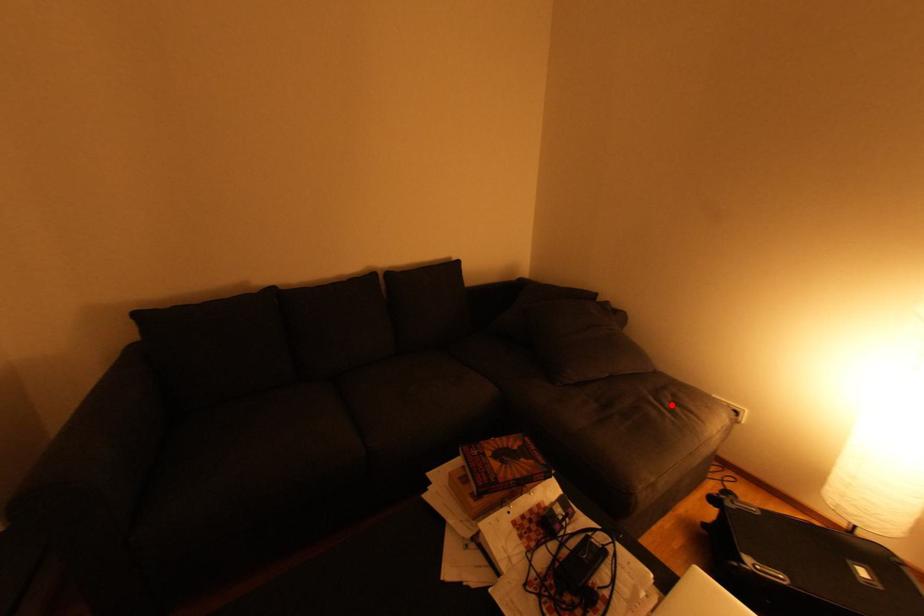
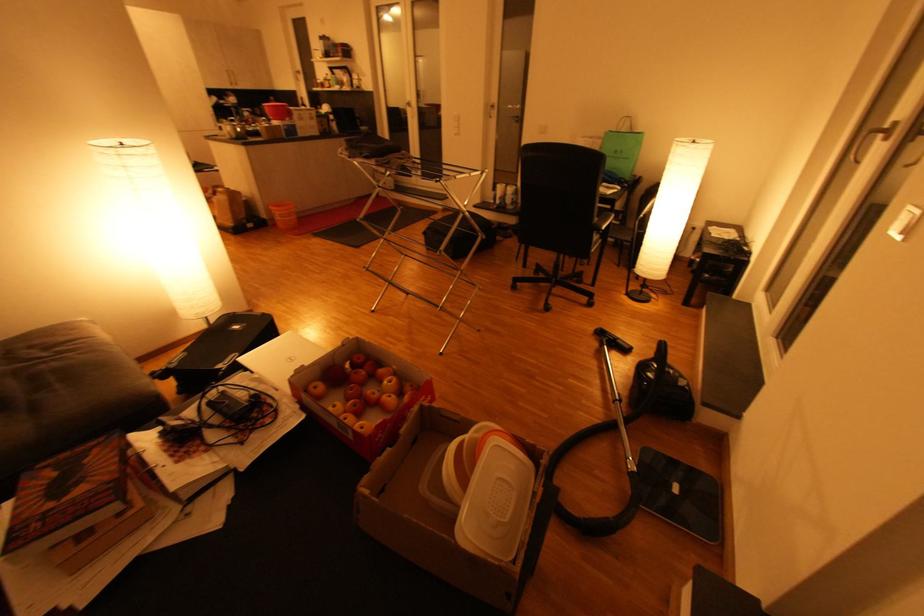
Find the pixel in the second image that matches the highlighted location in the first image.

(47, 355)